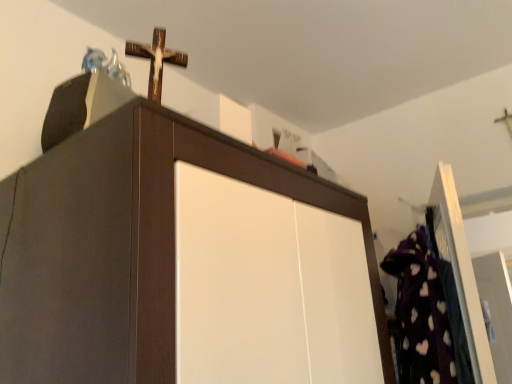
Question: Should I look upward or downward to see wooden cross at upper center?

Choices:
 (A) down
 (B) up

Answer: (B)